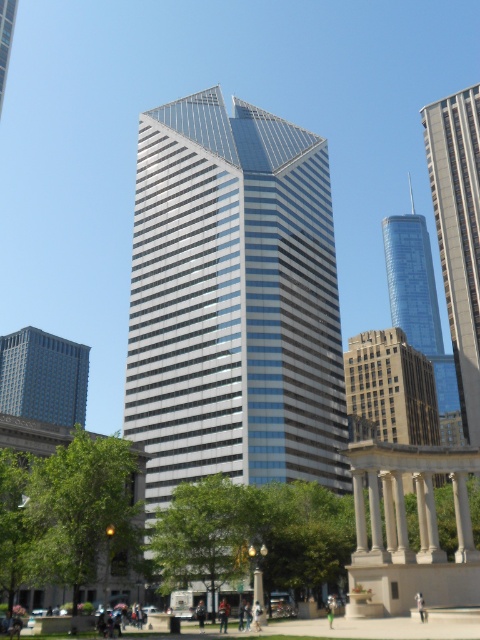
Question: Among these points, which one is nearest to the camera?

Choices:
 (A) (371, 513)
 (B) (402, 321)

Answer: (A)

Question: Among these objects, which one is farthest from the camera?

Choices:
 (A) green leafy tree at center
 (B) glassy steel skyscraper at right
 (C) white marble pillar at center
 (D) matte glass skyscraper at center

Answer: (D)

Question: Is glassy steel skyscraper at center above green leafy tree at center?

Choices:
 (A) no
 (B) yes

Answer: (B)

Question: Is green leafy tree at lower left to the left of glassy steel skyscraper at right from the viewer's perspective?

Choices:
 (A) no
 (B) yes

Answer: (B)

Question: Does green leafy tree at lower left have a lesser width compared to glassy steel skyscraper at right?

Choices:
 (A) no
 (B) yes

Answer: (A)

Question: Which of these objects is positioned farthest from the matte glass skyscraper at center?

Choices:
 (A) green leafy tree at lower left
 (B) green leafy tree at center

Answer: (A)